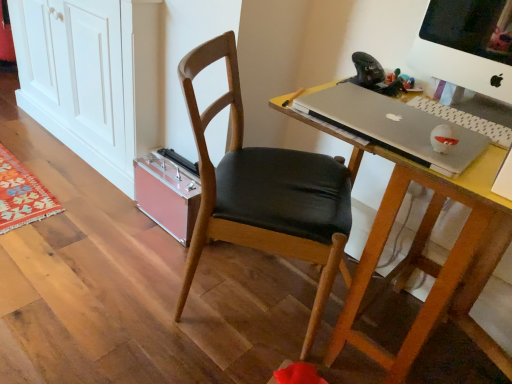
Question: Is wooden desk at center far away from pink plastic cabinet at lower left?

Choices:
 (A) no
 (B) yes

Answer: (B)

Question: From the image's perspective, would you say wooden desk at center is shown under pink plastic cabinet at lower left?

Choices:
 (A) yes
 (B) no

Answer: (A)

Question: From a real-world perspective, is wooden desk at center below pink plastic cabinet at lower left?

Choices:
 (A) yes
 (B) no

Answer: (A)

Question: From the image's perspective, would you say wooden desk at center is positioned over pink plastic cabinet at lower left?

Choices:
 (A) no
 (B) yes

Answer: (A)

Question: Can you confirm if wooden desk at center is shorter than pink plastic cabinet at lower left?

Choices:
 (A) no
 (B) yes

Answer: (B)

Question: In terms of size, does white plastic computer monitor at upper right appear bigger or smaller than silver metallic laptop at center?

Choices:
 (A) big
 (B) small

Answer: (A)

Question: Is white plastic computer monitor at upper right wider or thinner than silver metallic laptop at center?

Choices:
 (A) thin
 (B) wide

Answer: (A)

Question: In the image, is white plastic computer monitor at upper right positioned in front of or behind silver metallic laptop at center?

Choices:
 (A) front
 (B) behind

Answer: (B)

Question: From a real-world perspective, is white plastic computer monitor at upper right physically located above or below silver metallic laptop at center?

Choices:
 (A) above
 (B) below

Answer: (A)

Question: From a real-world perspective, is wooden desk at center positioned above or below white plastic computer monitor at upper right?

Choices:
 (A) below
 (B) above

Answer: (A)

Question: Is point (384, 195) positioned closer to the camera than point (459, 11)?

Choices:
 (A) closer
 (B) farther

Answer: (B)

Question: Considering the positions of wooden desk at center and white plastic computer monitor at upper right in the image, is wooden desk at center wider or thinner than white plastic computer monitor at upper right?

Choices:
 (A) wide
 (B) thin

Answer: (A)

Question: Considering the relative positions of wooden desk at center and white plastic computer monitor at upper right in the image provided, is wooden desk at center to the left or to the right of white plastic computer monitor at upper right?

Choices:
 (A) right
 (B) left

Answer: (B)

Question: From a real-world perspective, is pink plastic cabinet at lower left positioned above or below wooden chair at center?

Choices:
 (A) above
 (B) below

Answer: (A)

Question: From their relative heights in the image, would you say pink plastic cabinet at lower left is taller or shorter than wooden chair at center?

Choices:
 (A) tall
 (B) short

Answer: (A)